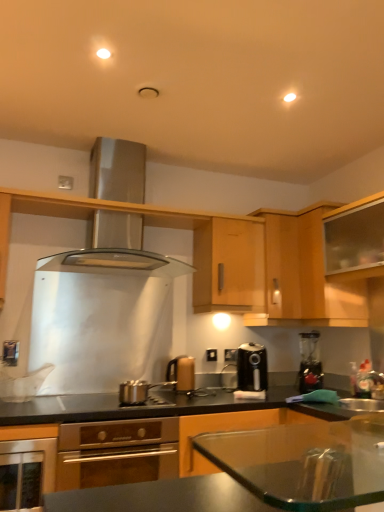
Question: Is light wood cabinet at center, arranged as the first cabinetry when viewed from the left, surrounded by stainless steel oven at lower left?

Choices:
 (A) no
 (B) yes

Answer: (A)

Question: Is light wood cabinet at center, the fourth cabinetry viewed from the right, at the back of stainless steel oven at lower left?

Choices:
 (A) yes
 (B) no

Answer: (B)

Question: Is stainless steel oven at lower left aimed at light wood cabinet at center, the fourth cabinetry viewed from the right?

Choices:
 (A) no
 (B) yes

Answer: (A)

Question: Does stainless steel oven at lower left lie in front of light wood cabinet at center, arranged as the first cabinetry when viewed from the left?

Choices:
 (A) yes
 (B) no

Answer: (A)

Question: From the image's perspective, does stainless steel oven at lower left appear lower than light wood cabinet at center, arranged as the first cabinetry when viewed from the left?

Choices:
 (A) no
 (B) yes

Answer: (B)

Question: Based on their positions, is matte gold kettle at center, which ranks as the second kitchen appliance in right-to-left order, located to the left or right of stainless steel oven at lower left?

Choices:
 (A) right
 (B) left

Answer: (A)

Question: In terms of height, does matte gold kettle at center, the 3th kitchen appliance viewed from the left, look taller or shorter compared to stainless steel oven at lower left?

Choices:
 (A) tall
 (B) short

Answer: (B)

Question: Relative to stainless steel oven at lower left, is matte gold kettle at center, the 3th kitchen appliance viewed from the left, in front or behind?

Choices:
 (A) front
 (B) behind

Answer: (B)

Question: From a real-world perspective, relative to stainless steel oven at lower left, is matte gold kettle at center, which ranks as the second kitchen appliance in right-to-left order, vertically above or below?

Choices:
 (A) below
 (B) above

Answer: (B)

Question: Is stainless steel oven at lower left taller or shorter than wooden cabinet at center, the second cabinetry in the left-to-right sequence?

Choices:
 (A) tall
 (B) short

Answer: (B)

Question: From a real-world perspective, relative to wooden cabinet at center, which is the 3th cabinetry in right-to-left order, is stainless steel oven at lower left vertically above or below?

Choices:
 (A) below
 (B) above

Answer: (A)

Question: Visually, is stainless steel oven at lower left positioned to the left or to the right of wooden cabinet at center, the second cabinetry in the left-to-right sequence?

Choices:
 (A) left
 (B) right

Answer: (A)

Question: From the image's perspective, is stainless steel oven at lower left positioned above or below wooden cabinet at center, the second cabinetry in the left-to-right sequence?

Choices:
 (A) above
 (B) below

Answer: (B)

Question: Looking at the image, does transparent glass cabinet at upper right, positioned as the first cabinetry in right-to-left order, seem bigger or smaller compared to light wood cabinet at center, the fourth cabinetry viewed from the right?

Choices:
 (A) big
 (B) small

Answer: (B)

Question: Considering their positions, is transparent glass cabinet at upper right, marked as the fourth cabinetry in a left-to-right arrangement, located in front of or behind light wood cabinet at center, the fourth cabinetry viewed from the right?

Choices:
 (A) front
 (B) behind

Answer: (A)